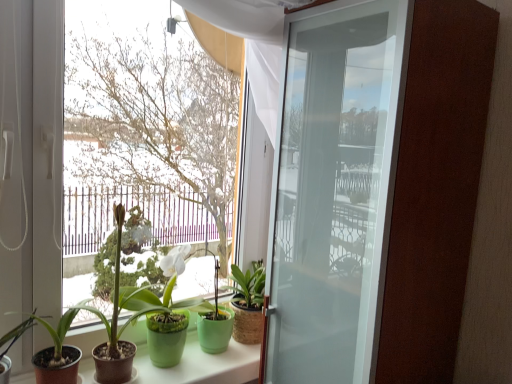
Question: Is transparent glass window at center taller or shorter than green matte pot at center, which is the fourth houseplant from left to right?

Choices:
 (A) tall
 (B) short

Answer: (A)

Question: Is transparent glass window at center wider or thinner than green matte pot at center, which is the fourth houseplant from left to right?

Choices:
 (A) wide
 (B) thin

Answer: (B)

Question: Considering the real-world distances, which object is closest to the green matte pot at lower left, arranged as the 1th houseplant when viewed from the left?

Choices:
 (A) burlap-textured plant pot at center, which appears as the fifth houseplant when viewed from the left
 (B) transparent glass window at center
 (C) green matte pot at center, which is the 3th houseplant from left to right
 (D) green matte pot at lower left, positioned as the fourth houseplant in right-to-left order
 (E) green matte pot at center, which is the fourth houseplant from left to right

Answer: (D)

Question: Considering the real-world distances, which object is closest to the burlap-textured plant pot at center, which appears as the fifth houseplant when viewed from the left?

Choices:
 (A) green matte pot at center, which is the 3th houseplant from left to right
 (B) green matte pot at center, which is the fourth houseplant from left to right
 (C) green matte plant pots at lower center
 (D) green matte pot at lower left, positioned as the 5th houseplant in right-to-left order
 (E) transparent glass window at center

Answer: (C)